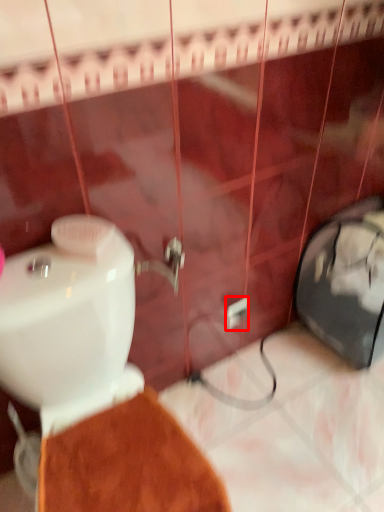
Question: Where is electric outlet (annotated by the red box) located in relation to toilet in the image?

Choices:
 (A) right
 (B) left

Answer: (A)